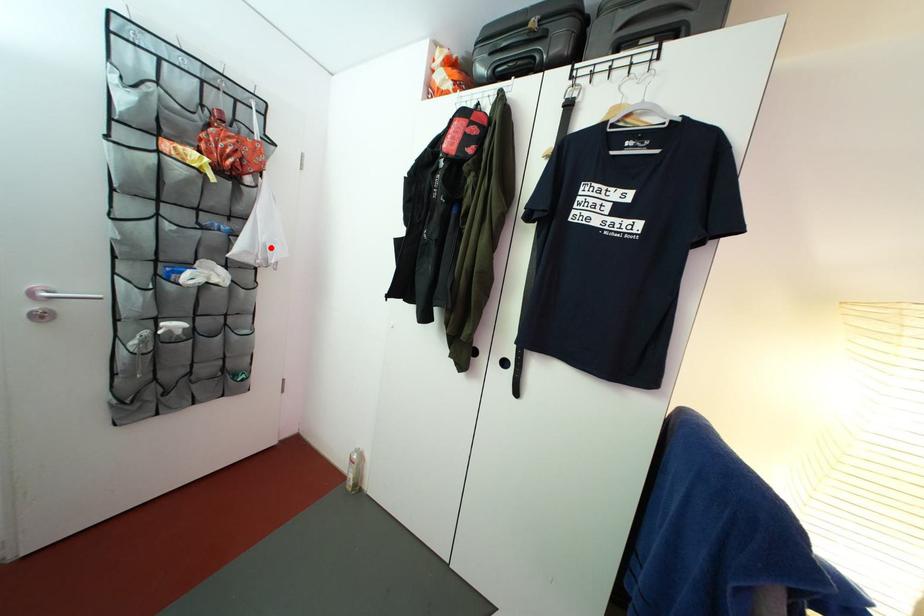
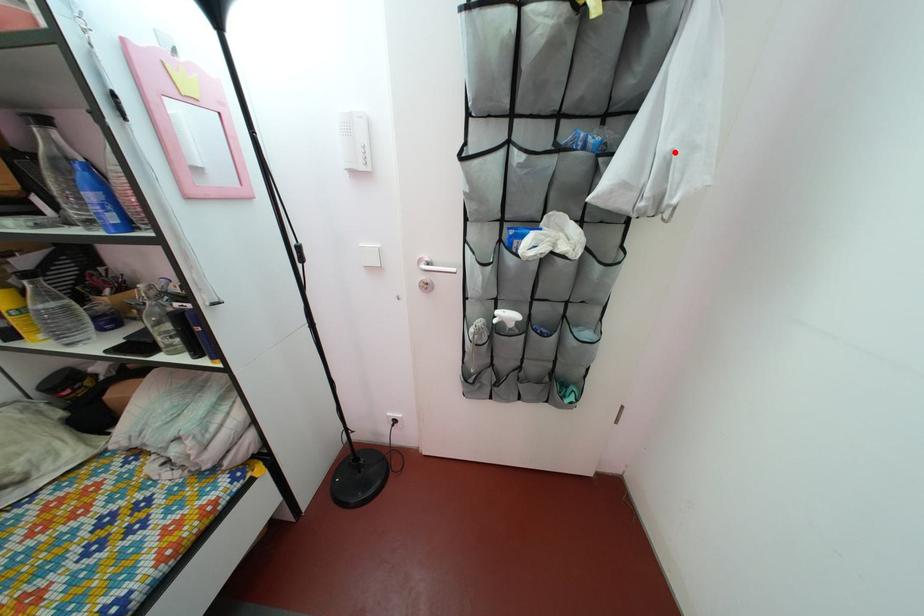
I am providing you with two images of the same scene from different viewpoints. A red point is marked on the first image and another point is marked on the second image. Are the points marked in image1 and image2 representing the same 3D position?

Yes